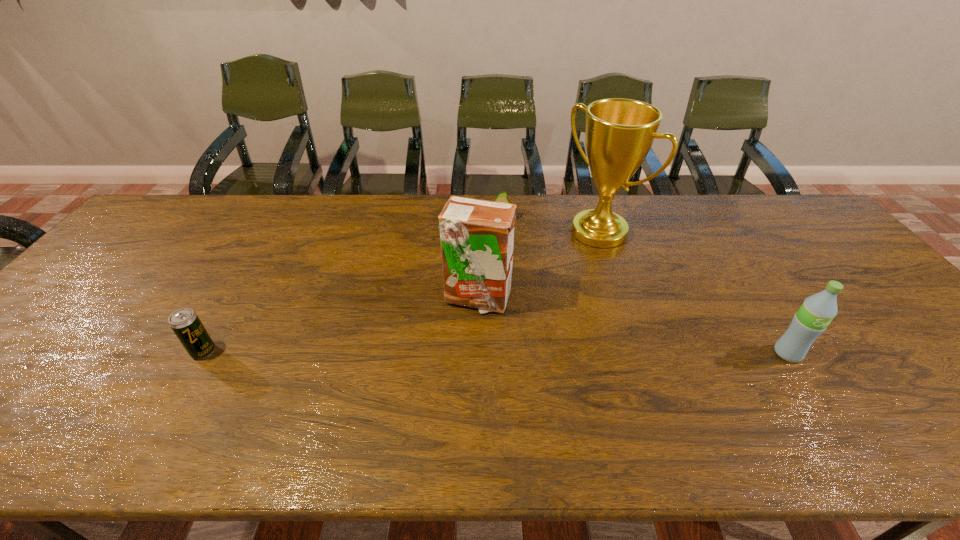
Identify the location of award situated at the far edge. The height and width of the screenshot is (540, 960). (619, 133).

Where is `vacant space at the far edge of the desktop`? This screenshot has width=960, height=540. vacant space at the far edge of the desktop is located at coordinates coord(496,195).

Where is `free spot at the near edge of the desktop`? The image size is (960, 540). free spot at the near edge of the desktop is located at coordinates (652, 396).

Where is `vacant point at the left edge`? The height and width of the screenshot is (540, 960). vacant point at the left edge is located at coordinates (101, 322).

This screenshot has height=540, width=960. Identify the location of free space at the right edge. click(x=852, y=288).

Find the location of a particular element. free space between the carton and the tallest object is located at coordinates (538, 265).

At what (x,y) coordinates should I click in order to perform the action: click on unoccupied area between the beer can and the rightmost object. Please return your answer as a coordinate pair (x, y). This screenshot has width=960, height=540. Looking at the image, I should click on (495, 353).

Locate an element on the screen. vacant area that lies between the beer can and the second object from right to left is located at coordinates (401, 292).

Find the location of a particular element. free point between the beer can and the avocado is located at coordinates pyautogui.click(x=351, y=285).

Where is `vacant area that lies between the tallest object and the beer can`? This screenshot has height=540, width=960. vacant area that lies between the tallest object and the beer can is located at coordinates (401, 292).